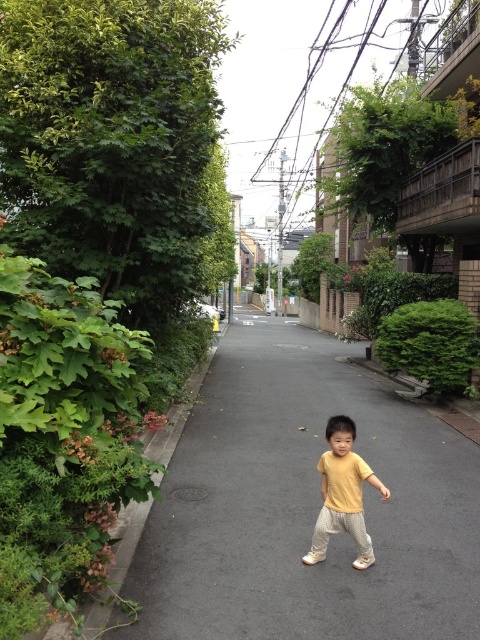
Is point (232, 636) in front of point (360, 554)?

Yes, it is.

Can you confirm if black asphalt pavement at center is smaller than yellow matte shirt at center?

No, black asphalt pavement at center is not smaller than yellow matte shirt at center.

Which is behind, point (476, 460) or point (347, 506)?

Point (476, 460)

Find the location of a particular element. Image resolution: width=480 pixels, height=640 pixels. black asphalt pavement at center is located at coordinates (304, 508).